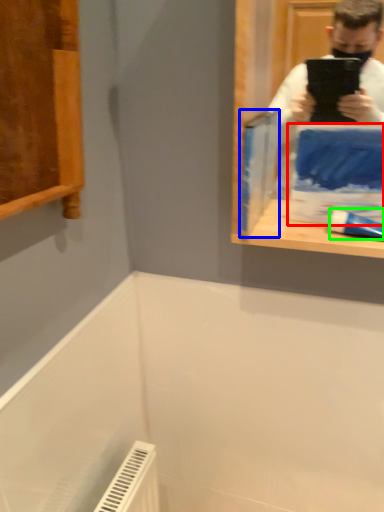
Question: Which is farther away from paperback book (highlighted by a red box)? paperback book (highlighted by a blue box) or toothpaste (highlighted by a green box)?

Choices:
 (A) paperback book
 (B) toothpaste

Answer: (A)